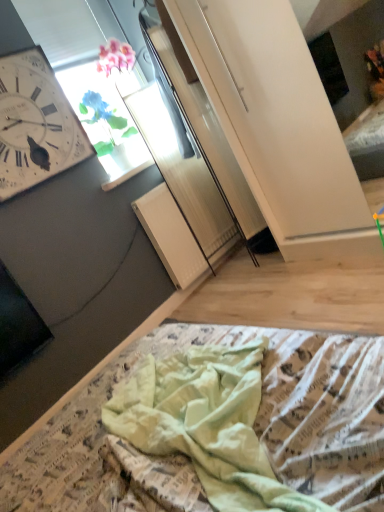
This screenshot has height=512, width=384. Find the location of `transparent glass window at upper center`. transparent glass window at upper center is located at coordinates (107, 119).

I want to click on white wooden wall clock at upper left, so click(35, 124).

What are the coordinates of `light green fabric at lower center` in the screenshot? It's located at (254, 423).

How far apart are light green fabric at lower center and transparent glass window at upper center?

light green fabric at lower center and transparent glass window at upper center are 1.48 meters apart from each other.

Is light green fabric at lower center with transparent glass window at upper center?

They are not placed beside each other.

Is point (307, 400) behind point (92, 115)?

No, (307, 400) is in front of (92, 115).

Would you say transparent glass window at upper center is outside white wooden wall clock at upper left?

That's correct, transparent glass window at upper center is outside of white wooden wall clock at upper left.

Visually, is transparent glass window at upper center positioned to the left or to the right of white wooden wall clock at upper left?

In the image, transparent glass window at upper center appears on the right side of white wooden wall clock at upper left.

Which object is more forward, transparent glass window at upper center or white wooden wall clock at upper left?

white wooden wall clock at upper left.

In the scene shown: From a real-world perspective, is transparent glass window at upper center physically located above or below white wooden wall clock at upper left?

transparent glass window at upper center is situated lower than white wooden wall clock at upper left in the real world.

Which of these two, white wooden wall clock at upper left or light green fabric at lower center, is thinner?

With smaller width is white wooden wall clock at upper left.

Which of these two, white wooden wall clock at upper left or light green fabric at lower center, stands taller?

white wooden wall clock at upper left.

Is white wooden wall clock at upper left positioned with its back to light green fabric at lower center?

white wooden wall clock at upper left is not turned away from light green fabric at lower center.

From the image's perspective, would you say white wooden wall clock at upper left is shown under light green fabric at lower center?

No, from the image's perspective, white wooden wall clock at upper left is not below light green fabric at lower center.

Considering the sizes of transparent glass window at upper center and light green fabric at lower center in the image, is transparent glass window at upper center taller or shorter than light green fabric at lower center?

transparent glass window at upper center is taller than light green fabric at lower center.

Considering the relative positions of transparent glass window at upper center and light green fabric at lower center in the image provided, is transparent glass window at upper center to the left of light green fabric at lower center from the viewer's perspective?

Yes.

Is transparent glass window at upper center placed right next to light green fabric at lower center?

No, transparent glass window at upper center is not in contact with light green fabric at lower center.

At what (x,y) coordinates should I click in order to perform the action: click on wall clock that is above the light green fabric at lower center (from a real-world perspective). Please return your answer as a coordinate pair (x, y). This screenshot has height=512, width=384. Looking at the image, I should click on (35, 124).

Are light green fabric at lower center and white wooden wall clock at upper left beside each other?

No, light green fabric at lower center is not beside white wooden wall clock at upper left.

Is light green fabric at lower center shorter than white wooden wall clock at upper left?

Indeed, light green fabric at lower center has a lesser height compared to white wooden wall clock at upper left.

What's the angular difference between light green fabric at lower center and white wooden wall clock at upper left's facing directions?

They differ by 167 degrees in their facing directions.

Is white wooden wall clock at upper left smaller than transparent glass window at upper center?

Correct, white wooden wall clock at upper left occupies less space than transparent glass window at upper center.

Is transparent glass window at upper center completely or partially inside white wooden wall clock at upper left?

Definitely not — transparent glass window at upper center is not inside white wooden wall clock at upper left.

Can you see white wooden wall clock at upper left touching transparent glass window at upper center?

No, white wooden wall clock at upper left is not in contact with transparent glass window at upper center.

In order to click on blanket to the right of transparent glass window at upper center in this screenshot , I will do `click(254, 423)`.

This screenshot has width=384, height=512. In order to click on wall clock located on the left of transparent glass window at upper center in this screenshot , I will do `click(35, 124)`.

Estimate the real-world distances between objects in this image. Which object is further from light green fabric at lower center, white wooden wall clock at upper left or transparent glass window at upper center?

The object further to light green fabric at lower center is transparent glass window at upper center.

Which object lies further to the anchor point white wooden wall clock at upper left, light green fabric at lower center or transparent glass window at upper center?

light green fabric at lower center lies further to white wooden wall clock at upper left than the other object.

Based on their spatial positions, is light green fabric at lower center or white wooden wall clock at upper left further from transparent glass window at upper center?

light green fabric at lower center lies further to transparent glass window at upper center than the other object.

Estimate the real-world distances between objects in this image. Which object is further from transparent glass window at upper center, white wooden wall clock at upper left or light green fabric at lower center?

light green fabric at lower center.

When comparing their distances from light green fabric at lower center, does transparent glass window at upper center or white wooden wall clock at upper left seem closer?

The object closer to light green fabric at lower center is white wooden wall clock at upper left.

Looking at the image, which one is located further to white wooden wall clock at upper left, transparent glass window at upper center or light green fabric at lower center?

Among the two, light green fabric at lower center is located further to white wooden wall clock at upper left.

Identify the location of wall clock located between light green fabric at lower center and transparent glass window at upper center in the depth direction. (35, 124).